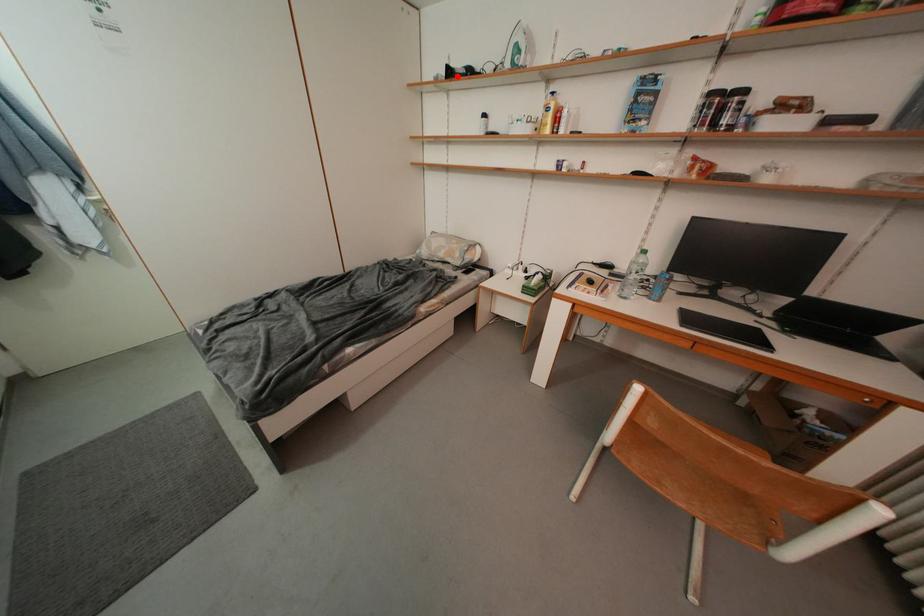
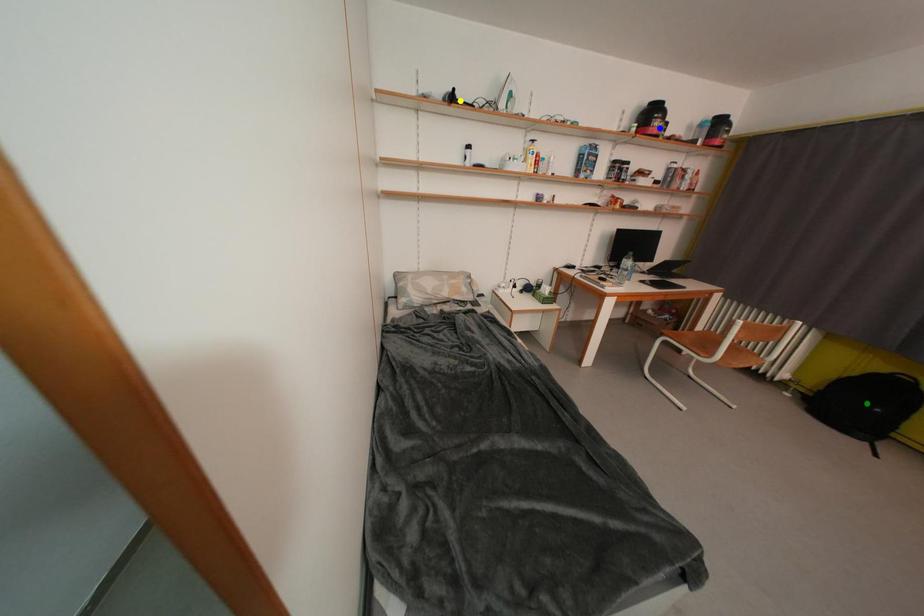
Question: I am providing you with two images of the same scene from different viewpoints. A red point is marked on the first image. You are given multiple points on the second image. Can you choose the point in image 2 that corresponds to the point in image 1?

Choices:
 (A) blue point
 (B) green point
 (C) yellow point

Answer: (C)